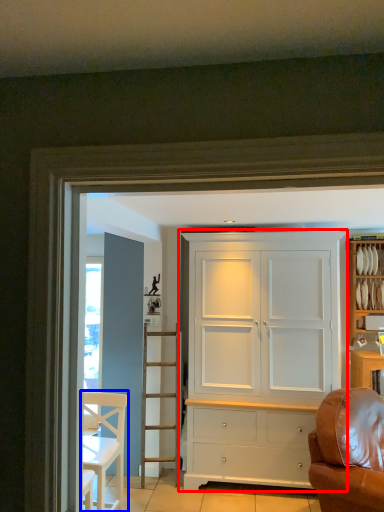
Question: Which point is further to the camera, cupboard (highlighted by a red box) or chair (highlighted by a blue box)?

Choices:
 (A) cupboard
 (B) chair

Answer: (A)